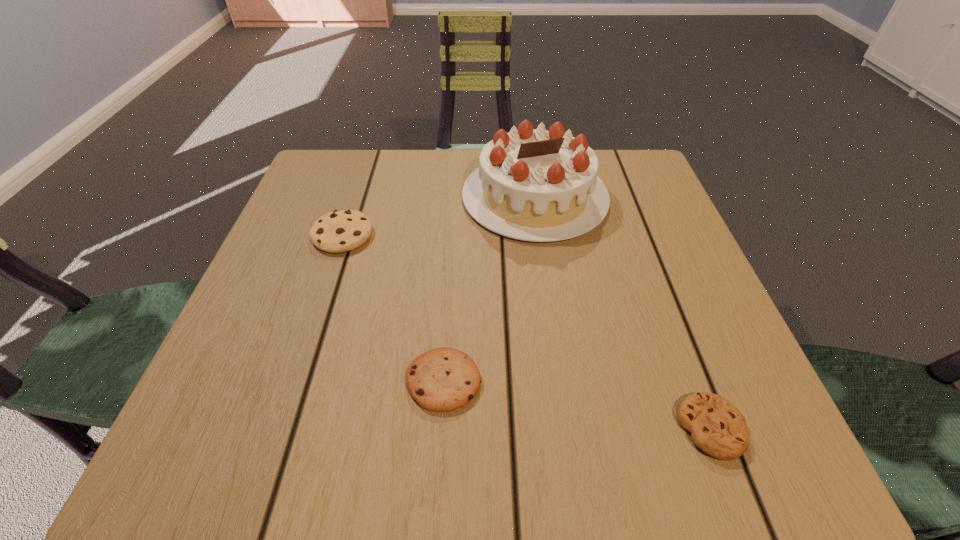
You are a GUI agent. You are given a task and a screenshot of the screen. Output one action in this format:
    pyautogui.click(x=<x>, y=<y>)
    Task: Click on the birthday cake
    
    Given the screenshot: What is the action you would take?
    pyautogui.click(x=536, y=185)

Locate an element on the screen. Image resolution: width=960 pixels, height=540 pixels. the leftmost cookie is located at coordinates (339, 231).

Locate an element on the screen. the tallest cookie is located at coordinates (339, 231).

The width and height of the screenshot is (960, 540). In order to click on the second shortest object in this screenshot , I will do `click(443, 379)`.

Locate an element on the screen. The image size is (960, 540). the second shortest cookie is located at coordinates (443, 379).

Find the location of a particular element. The height and width of the screenshot is (540, 960). the rightmost cookie is located at coordinates (717, 427).

Locate an element on the screen. This screenshot has width=960, height=540. the shortest cookie is located at coordinates (717, 427).

Find the location of a particular element. vacant region located on the left of the birthday cake is located at coordinates (333, 197).

You are a GUI agent. You are given a task and a screenshot of the screen. Output one action in this format:
    pyautogui.click(x=<x>, y=<y>)
    Task: Click on the free location located on the front of the leftmost object
    The width and height of the screenshot is (960, 540).
    Given the screenshot: What is the action you would take?
    pyautogui.click(x=300, y=365)

The height and width of the screenshot is (540, 960). In order to click on vacant region located on the left of the second shortest cookie in this screenshot , I will do `click(359, 381)`.